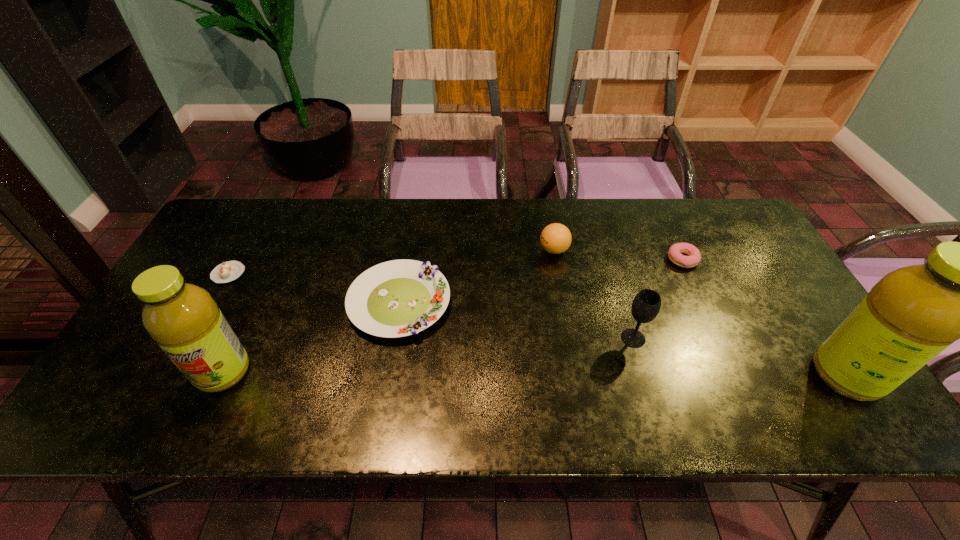
At what (x,y) coordinates should I click in order to perform the action: click on the fifth object from right to left. Please return your answer as a coordinate pair (x, y). This screenshot has height=540, width=960. Looking at the image, I should click on (398, 298).

This screenshot has height=540, width=960. I want to click on vacant position located 0.120m on the right of the second object from right to left, so click(739, 260).

In order to click on free space located on the side with brand of the fourth object from left to right in this screenshot , I will do `click(456, 250)`.

In order to click on blank space located on the side with brand of the fourth object from left to right in this screenshot , I will do `click(425, 250)`.

You are a GUI agent. You are given a task and a screenshot of the screen. Output one action in this format:
    pyautogui.click(x=<x>, y=<y>)
    Task: Click on the free location located 0.390m on the side with brand of the fourth object from left to right
    
    Given the screenshot: What is the action you would take?
    pyautogui.click(x=409, y=250)

Locate an element on the screen. This screenshot has width=960, height=540. free space located on the back of the leftmost object is located at coordinates (263, 212).

The width and height of the screenshot is (960, 540). Find the location of `free point located 0.100m on the back of the wineglass`. free point located 0.100m on the back of the wineglass is located at coordinates (621, 299).

This screenshot has height=540, width=960. I want to click on free space located on the left of the salad plate, so click(x=226, y=302).

Image resolution: width=960 pixels, height=540 pixels. In order to click on object that is at the far edge in this screenshot , I will do `click(555, 238)`.

Find the location of `object positioned at the left edge`. object positioned at the left edge is located at coordinates (228, 271).